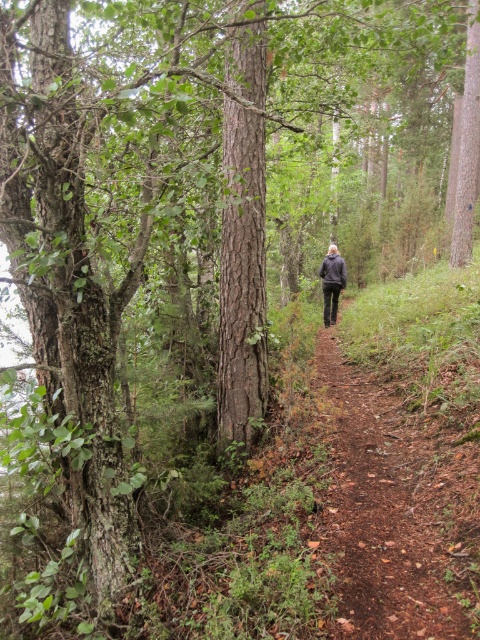
Is brown dirt path at center thinner than dark gray jacket at center?

No, brown dirt path at center is not thinner than dark gray jacket at center.

Does brown dirt path at center lie behind dark gray jacket at center?

No, brown dirt path at center is in front of dark gray jacket at center.

Image resolution: width=480 pixels, height=640 pixels. What do you see at coordinates (396, 509) in the screenshot? I see `brown dirt path at center` at bounding box center [396, 509].

Where is `brown dirt path at center`? brown dirt path at center is located at coordinates (396, 509).